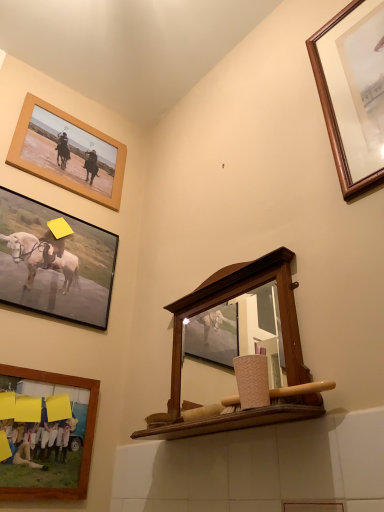
Question: Is wooden frame at upper left, marked as the first picture frame in a left-to-right arrangement, shorter than wooden mirror at center?

Choices:
 (A) no
 (B) yes

Answer: (B)

Question: Would you say wooden frame at upper left, marked as the first picture frame in a left-to-right arrangement, is outside wooden mirror at center?

Choices:
 (A) no
 (B) yes

Answer: (B)

Question: Is wooden frame at upper left, marked as the first picture frame in a left-to-right arrangement, closer to the viewer compared to wooden mirror at center?

Choices:
 (A) yes
 (B) no

Answer: (B)

Question: Is wooden frame at upper left, which is the fourth picture frame in right-to-left order, further to the viewer compared to wooden mirror at center?

Choices:
 (A) yes
 (B) no

Answer: (A)

Question: From the image's perspective, would you say wooden frame at upper left, marked as the first picture frame in a left-to-right arrangement, is shown under wooden mirror at center?

Choices:
 (A) yes
 (B) no

Answer: (B)

Question: Looking at the image, does matte black frame at upper left, which appears as the third picture frame when viewed from the right, seem bigger or smaller compared to wooden frame at upper left, marked as the first picture frame in a left-to-right arrangement?

Choices:
 (A) big
 (B) small

Answer: (A)

Question: From the image's perspective, is matte black frame at upper left, which appears as the third picture frame when viewed from the right, located above or below wooden frame at upper left, which is the fourth picture frame in right-to-left order?

Choices:
 (A) above
 (B) below

Answer: (B)

Question: In the image, is matte black frame at upper left, which ranks as the second picture frame in left-to-right order, on the left side or the right side of wooden frame at upper left, which is the fourth picture frame in right-to-left order?

Choices:
 (A) left
 (B) right

Answer: (B)

Question: Is matte black frame at upper left, which appears as the third picture frame when viewed from the right, inside the boundaries of wooden frame at upper left, which is the fourth picture frame in right-to-left order, or outside?

Choices:
 (A) outside
 (B) inside

Answer: (A)

Question: From the image's perspective, relative to matte black frame at upper left, which ranks as the second picture frame in left-to-right order, is wooden-framed picture at lower left, the 2th picture frame viewed from the right, above or below?

Choices:
 (A) below
 (B) above

Answer: (A)

Question: Considering the relative positions of wooden-framed picture at lower left, the third picture frame positioned from the left, and matte black frame at upper left, which appears as the third picture frame when viewed from the right, in the image provided, is wooden-framed picture at lower left, the third picture frame positioned from the left, to the left or to the right of matte black frame at upper left, which appears as the third picture frame when viewed from the right,?

Choices:
 (A) right
 (B) left

Answer: (A)

Question: From a real-world perspective, is wooden-framed picture at lower left, the 2th picture frame viewed from the right, above or below matte black frame at upper left, which appears as the third picture frame when viewed from the right?

Choices:
 (A) above
 (B) below

Answer: (B)

Question: From their relative heights in the image, would you say wooden-framed picture at lower left, the 2th picture frame viewed from the right, is taller or shorter than matte black frame at upper left, which ranks as the second picture frame in left-to-right order?

Choices:
 (A) tall
 (B) short

Answer: (B)

Question: Is point tap(340, 99) closer or farther from the camera than point tap(31, 110)?

Choices:
 (A) farther
 (B) closer

Answer: (B)

Question: In terms of size, does wooden picture frame at upper right, the fourth picture frame in the left-to-right sequence, appear bigger or smaller than wooden frame at upper left, marked as the first picture frame in a left-to-right arrangement?

Choices:
 (A) small
 (B) big

Answer: (B)